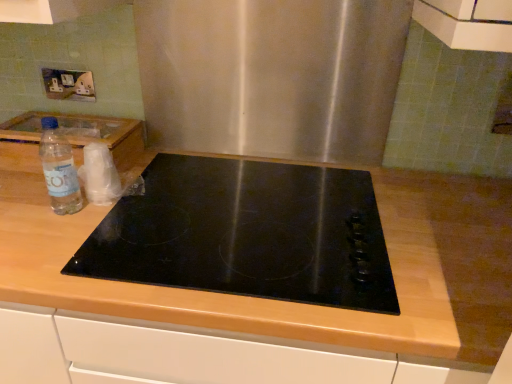
I want to click on vacant space in front of clear plastic bottle at left, so click(x=53, y=241).